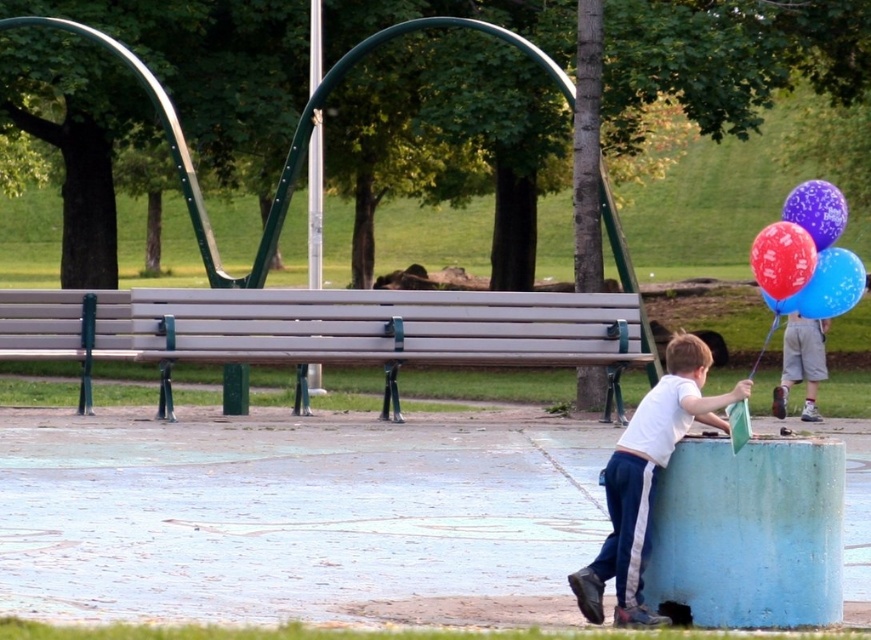
Which is behind, point (451, 298) or point (836, 259)?

Point (451, 298)

Is wooden bench at center above blue glossy balloon at upper right?

No, wooden bench at center is not above blue glossy balloon at upper right.

Where is `wooden bench at center`? This screenshot has width=871, height=640. wooden bench at center is located at coordinates (389, 332).

Which is above, white matte shirt at lower right or matte metallic balloons at right?

matte metallic balloons at right

Image resolution: width=871 pixels, height=640 pixels. In order to click on white matte shirt at lower right in this screenshot , I will do `click(647, 480)`.

Between white matte shirt at lower right and light brown shorts at right, which one appears on the right side from the viewer's perspective?

light brown shorts at right is more to the right.

Who is more forward, (640, 417) or (792, 337)?

Point (640, 417)

Identify the location of white matte shirt at lower right. Image resolution: width=871 pixels, height=640 pixels. (647, 480).